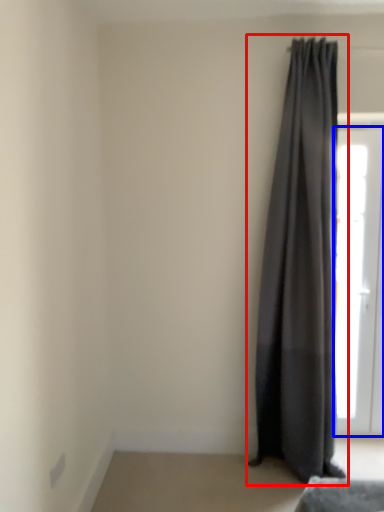
Question: Which of the following is the farthest to the observer, curtain (highlighted by a red box) or door (highlighted by a blue box)?

Choices:
 (A) curtain
 (B) door

Answer: (B)